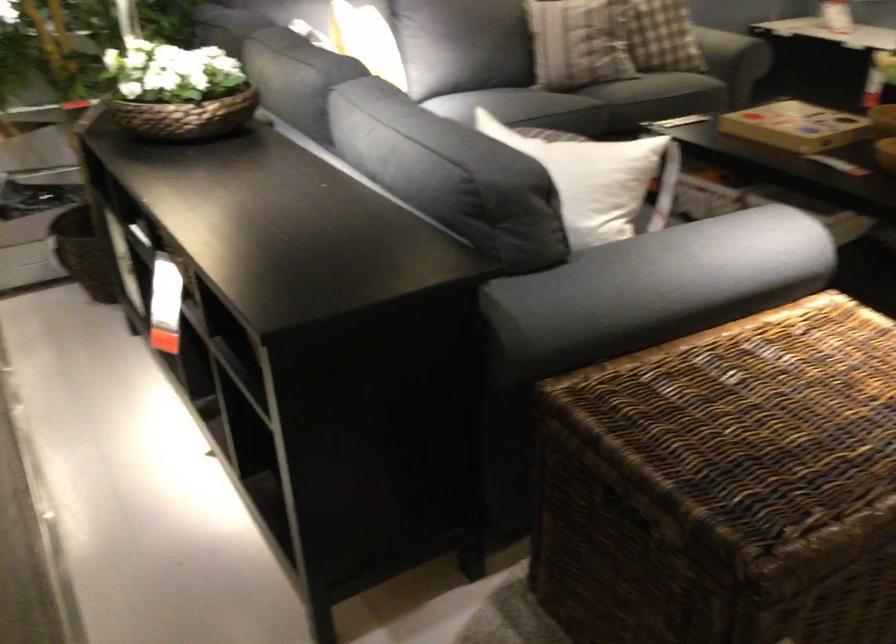
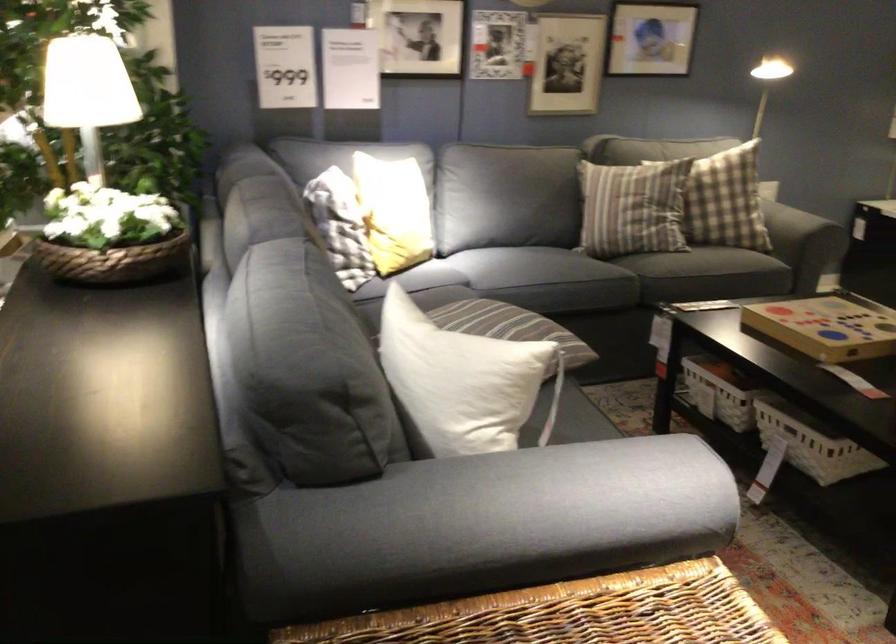
The point at (x=821, y=223) is marked in the first image. Where is the corresponding point in the second image?

(814, 448)